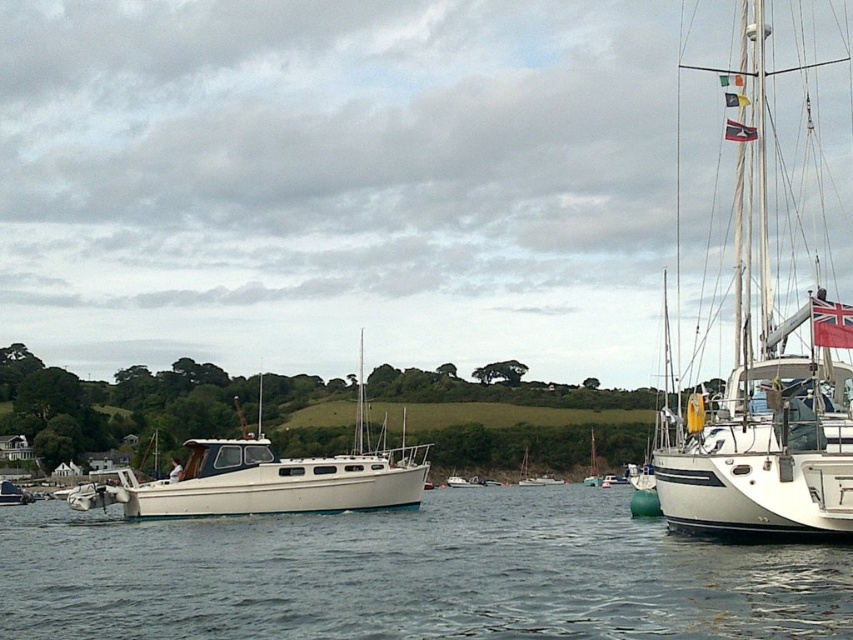
In the scene shown: You are a sailor who needs to anchor your boat in the harbor. The safe anchoring distance is 15 meters. Given the clear water at center and the white matte boat at center, can you safely anchor your boat here?

The clear water at center is 16.44 meters from the white matte boat at center. Since the safe anchoring distance is 15 meters, anchoring here would be safe as the distance exceeds the required minimum.

You are standing at the shoreline in the harbor scene. There is a point marked at coordinates point (410, 576) which is clear water at center. Can you see the white motorboat with a small cabin slightly left of center from that point?

The point (410, 576) indicates clear water at center, so you can see the white motorboat with a small cabin slightly left of center from that point because it is positioned in the foreground and the clear water at center provides an unobstructed view.